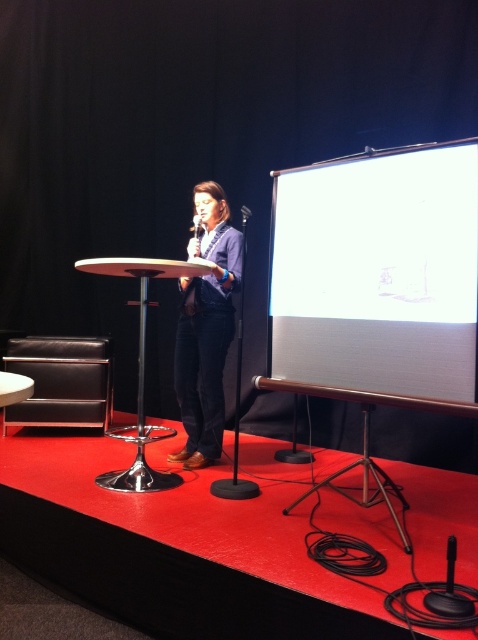
Question: Does denim jacket at center appear under metallic silver podium at center?

Choices:
 (A) no
 (B) yes

Answer: (A)

Question: Estimate the real-world distances between objects in this image. Which object is farther from the denim jacket at center?

Choices:
 (A) black matte microphone at center
 (B) white matte projection screen at right
 (C) metallic silver podium at center

Answer: (A)

Question: Does denim jacket at center have a larger size compared to metallic silver podium at center?

Choices:
 (A) no
 (B) yes

Answer: (A)

Question: Which point is closer to the camera?

Choices:
 (A) black matte microphone at center
 (B) denim jacket at center
 (C) white matte projection screen at right

Answer: (C)

Question: Does white matte projection screen at right appear on the left side of denim jacket at center?

Choices:
 (A) no
 (B) yes

Answer: (A)

Question: Which of these objects is positioned closest to the white matte projection screen at right?

Choices:
 (A) black plastic microphone at center
 (B) denim jacket at center
 (C) metallic silver podium at center
 (D) black matte microphone at center

Answer: (B)